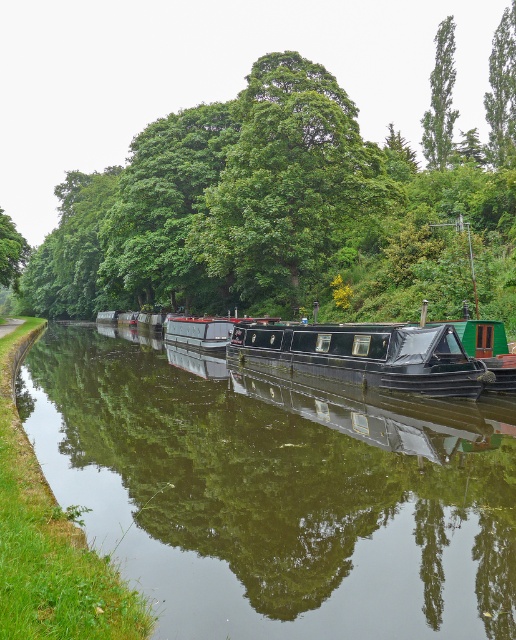
You are standing at the point marked as point (x=277, y=493) in the canal scene. What is the color of the water surface directly beneath your feet?

The smooth black water at center is located at point (x=277, y=493), so the water surface directly beneath your feet is black.

You are a photographer aiming to capture the green leafy tree at upper center and the smooth black water at center in your shot. Which object is located to the right of the other?

The smooth black water at center is positioned on the left side of green leafy tree at upper center, so the green leafy tree at upper center is to the right of the smooth black water at center.